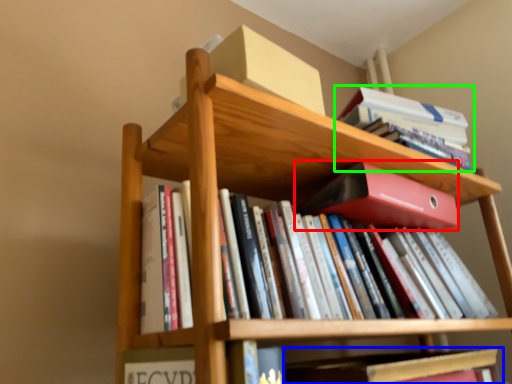
Question: Estimate the real-world distances between objects in this image. Which object is farther from paperback book (highlighted by a red box), book (highlighted by a blue box) or book (highlighted by a green box)?

Choices:
 (A) book
 (B) book

Answer: (A)